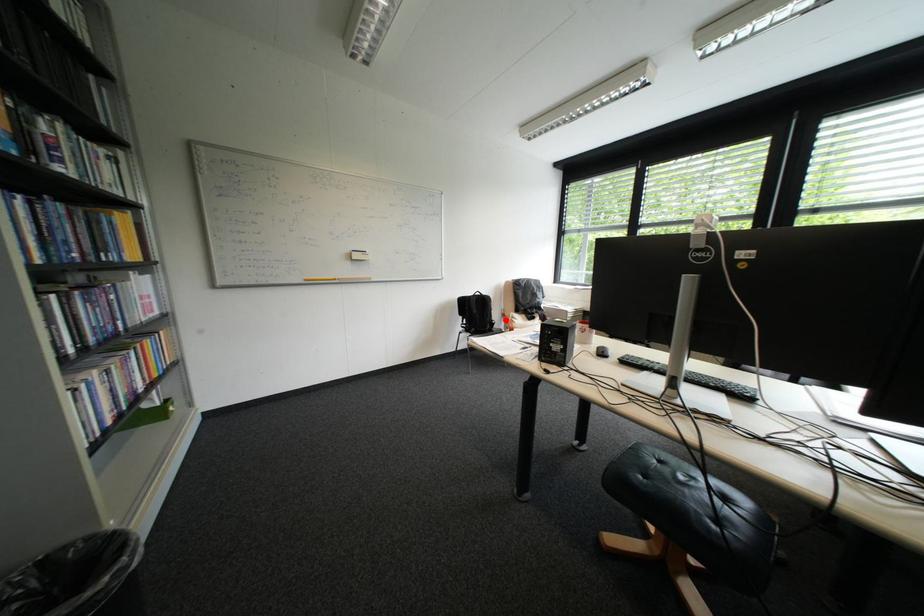
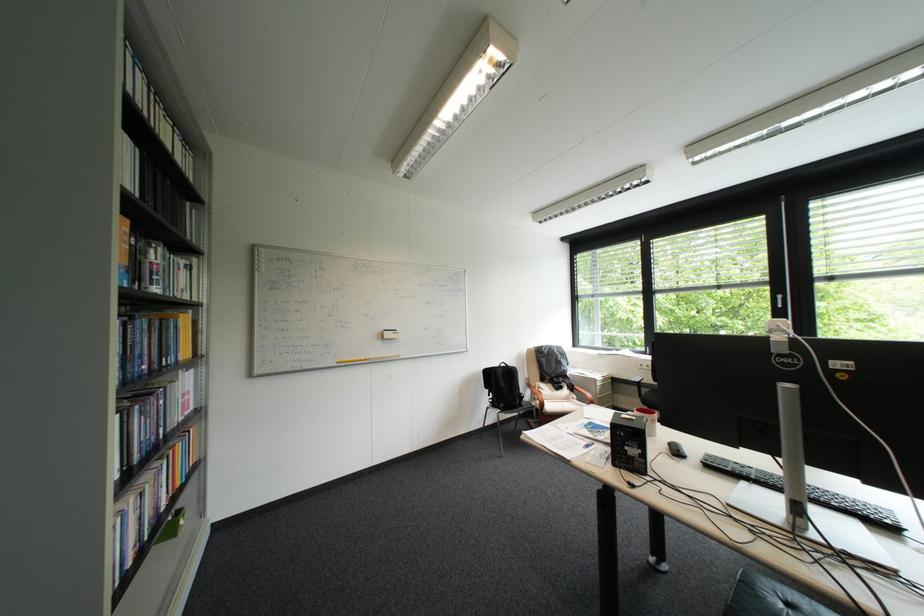
Locate, in the second image, the point that corresponds to the highlighted location in the first image.

(533, 392)